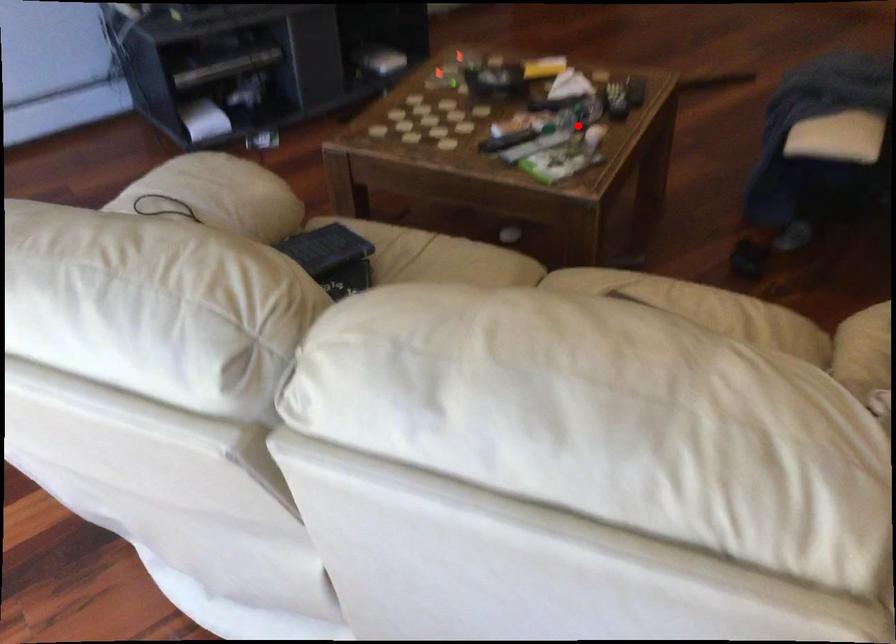
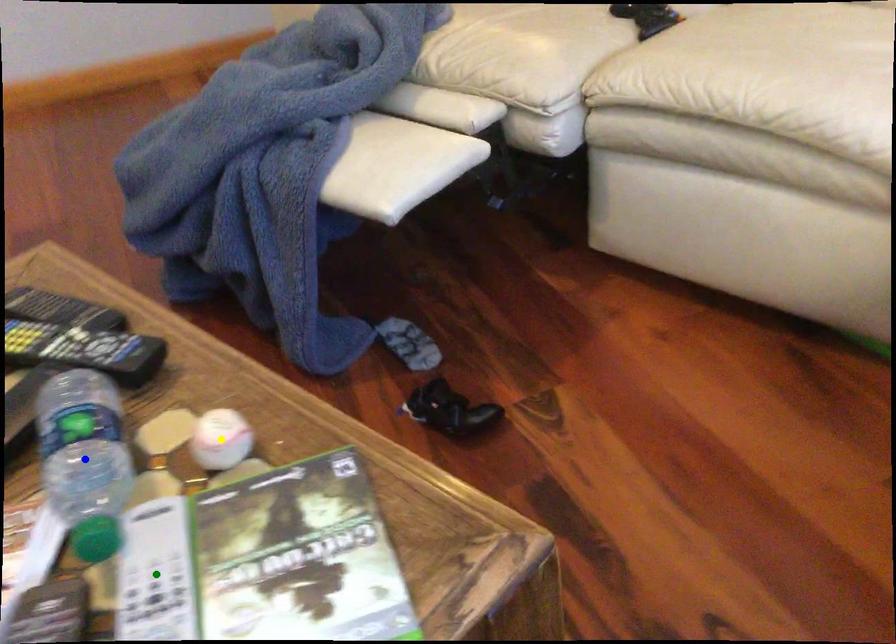
Question: I am providing you with two images of the same scene from different viewpoints. A red point is marked on the first image. You are given multiple points on the second image. Which point in image 2 is actually the same real-world point as the red point in image 1?

Choices:
 (A) green point
 (B) yellow point
 (C) blue point

Answer: (B)